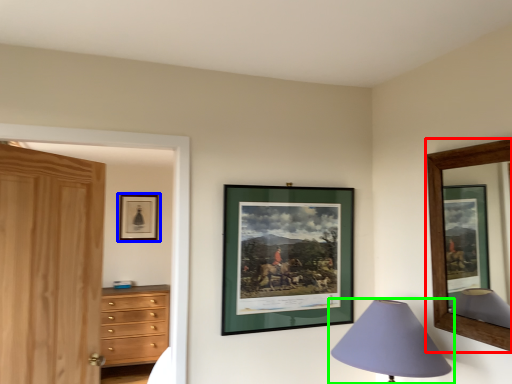
Question: Estimate the real-world distances between objects in this image. Which object is farther from picture frame (highlighted by a red box), picture frame (highlighted by a blue box) or lamp (highlighted by a green box)?

Choices:
 (A) picture frame
 (B) lamp

Answer: (A)